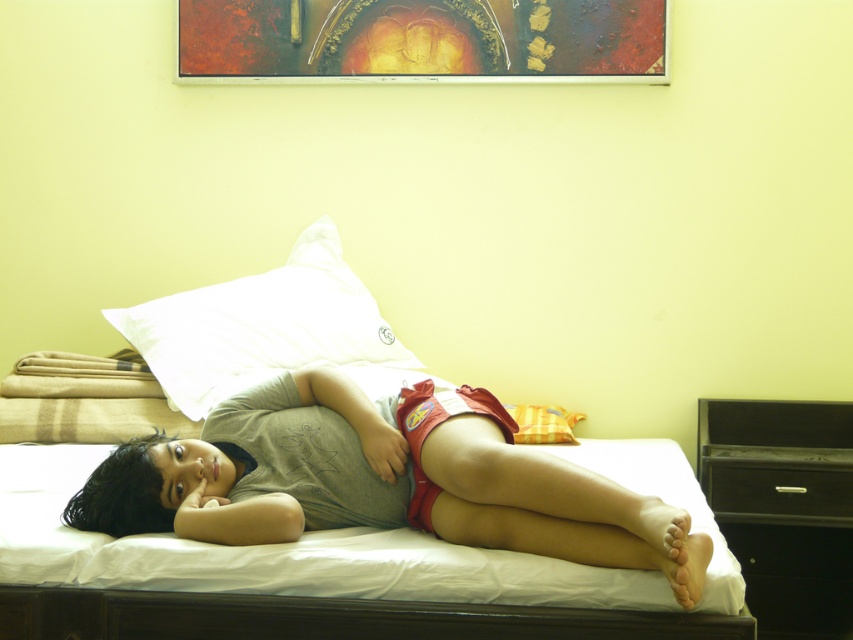
Question: Based on their relative distances, which object is farther from the black wood drawer at lower right?

Choices:
 (A) metallic gold picture frame at upper center
 (B) white soft pillow at upper center

Answer: (A)

Question: Based on their relative distances, which object is nearer to the matte gray t-shirt at center?

Choices:
 (A) black wood drawer at lower right
 (B) black matte drawer at lower right
 (C) metallic gold picture frame at upper center

Answer: (B)

Question: Can you confirm if matte gray t-shirt at center is wider than black wood drawer at lower right?

Choices:
 (A) yes
 (B) no

Answer: (A)

Question: Can you confirm if metallic gold picture frame at upper center is bigger than black wood drawer at lower right?

Choices:
 (A) yes
 (B) no

Answer: (B)

Question: Which is farther from the white soft pillow at upper center?

Choices:
 (A) matte gray t-shirt at center
 (B) black matte drawer at lower right
 (C) metallic gold picture frame at upper center
 (D) black wood drawer at lower right

Answer: (D)

Question: Can you confirm if black wood drawer at lower right is positioned to the right of white soft pillow at upper center?

Choices:
 (A) yes
 (B) no

Answer: (A)